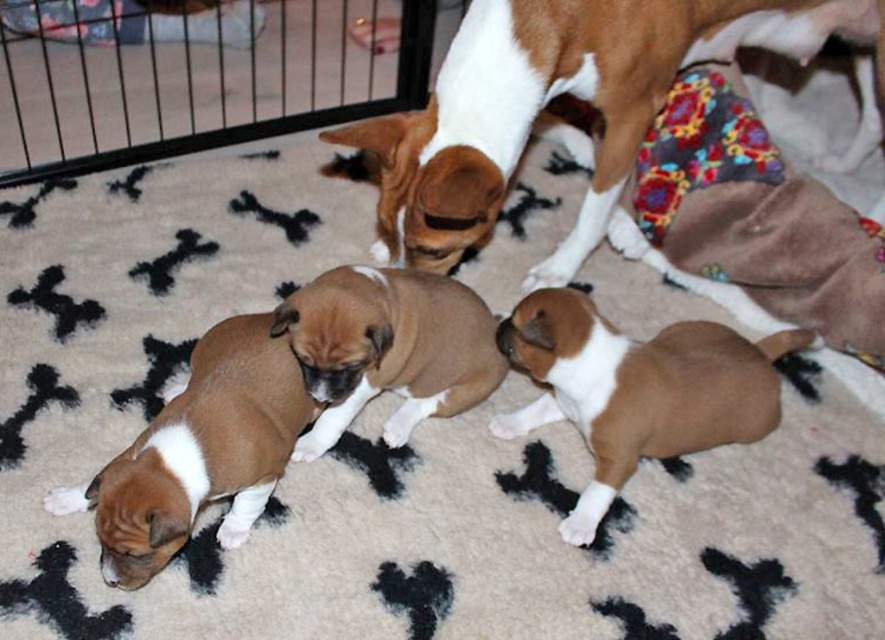
Question: Among these points, which one is nearest to the camera?

Choices:
 (A) (456, 172)
 (B) (594, 481)
 (C) (266, 342)

Answer: (C)

Question: Which object is closer to the camera taking this photo?

Choices:
 (A) brown soft fur puppy at lower left
 (B) brown and white fur at upper center
 (C) black metal cage at upper left

Answer: (A)

Question: Does black metal cage at upper left come in front of brown matte puppy at lower right?

Choices:
 (A) yes
 (B) no

Answer: (B)

Question: Does brown and white fur at upper center appear under brown soft fur puppy at lower left?

Choices:
 (A) yes
 (B) no

Answer: (B)

Question: Which point is farther from the camera taking this photo?

Choices:
 (A) (387, 356)
 (B) (229, 3)

Answer: (B)

Question: Does brown soft fur puppy at lower left have a larger size compared to brown smooth puppy at center?

Choices:
 (A) yes
 (B) no

Answer: (A)